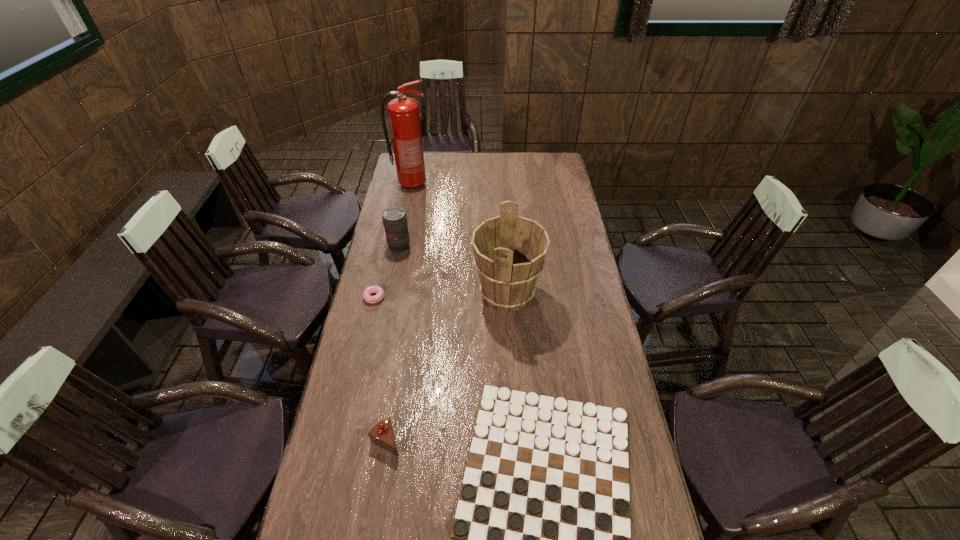
This screenshot has height=540, width=960. In order to click on vacant point located 0.210m on the right of the chocolate cake in this screenshot , I will do `click(471, 441)`.

The height and width of the screenshot is (540, 960). I want to click on vacant space located 0.340m on the back of the doughnut, so click(x=391, y=235).

You are a GUI agent. You are given a task and a screenshot of the screen. Output one action in this format:
    pyautogui.click(x=<x>, y=<y>)
    Task: Click on the fire extinguisher situated at the left edge
    The width and height of the screenshot is (960, 540).
    Given the screenshot: What is the action you would take?
    (404, 117)

Locate an element on the screen. The height and width of the screenshot is (540, 960). telephoto lens situated at the left edge is located at coordinates (394, 218).

Image resolution: width=960 pixels, height=540 pixels. Find the location of `chocolate cake that is positioned at the left edge`. chocolate cake that is positioned at the left edge is located at coordinates (382, 434).

Find the location of a particular element. This screenshot has height=540, width=960. doughnut positioned at the left edge is located at coordinates (367, 297).

Locate an element on the screen. Image resolution: width=960 pixels, height=540 pixels. blank space at the far edge of the desktop is located at coordinates (491, 163).

This screenshot has width=960, height=540. Find the location of `free region at the left edge`. free region at the left edge is located at coordinates (354, 338).

The image size is (960, 540). Identify the location of free point at the right edge. (564, 262).

In the image, there is a desktop. Identify the location of vacant space at the far right corner. This screenshot has width=960, height=540. (548, 163).